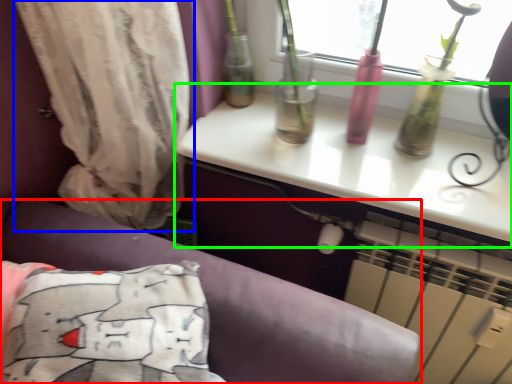
Question: Considering the real-world distances, which object is closest to furniture (highlighted by a red box)? curtain (highlighted by a blue box) or table (highlighted by a green box).

Choices:
 (A) curtain
 (B) table

Answer: (A)